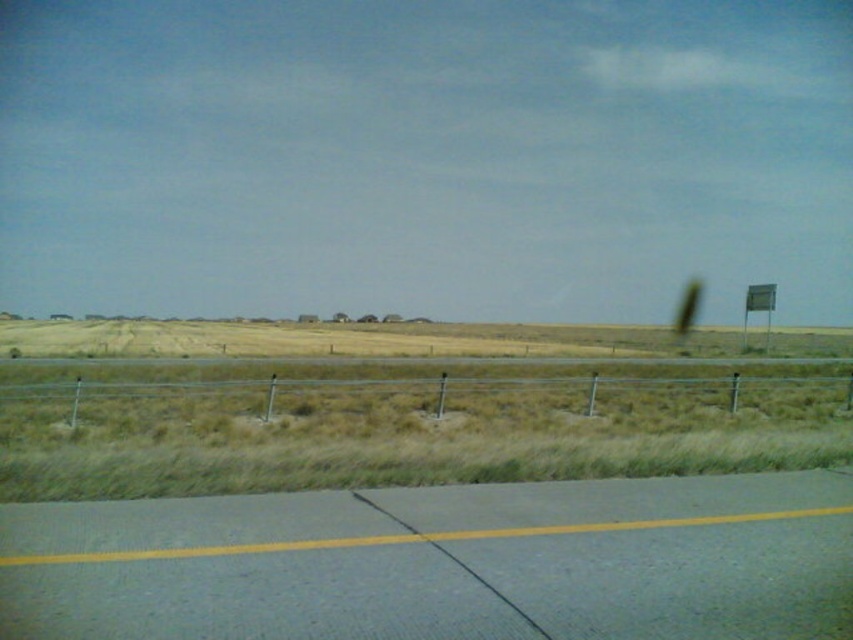
You are a photographer planning to capture a wide landscape shot. You notice the metallic wire fence at center and the metallic sign at right in your frame. Which object will appear narrower in the final photo?

The metallic wire fence at center will appear narrower in the final photo because it is thinner than the metallic sign at right.

You are a driver approaching the asphalt road at lower center and see the metallic sign at right. Which object is closer to you as you drive along the road?

The asphalt road at lower center is closer to you than the metallic sign at right because it is positioned below it in the scene.

You are driving a car and see the asphalt road at lower center and the metallic wire fence at center. Which one is closer to you?

The asphalt road at lower center is closer to you because it is in front of the metallic wire fence at center.